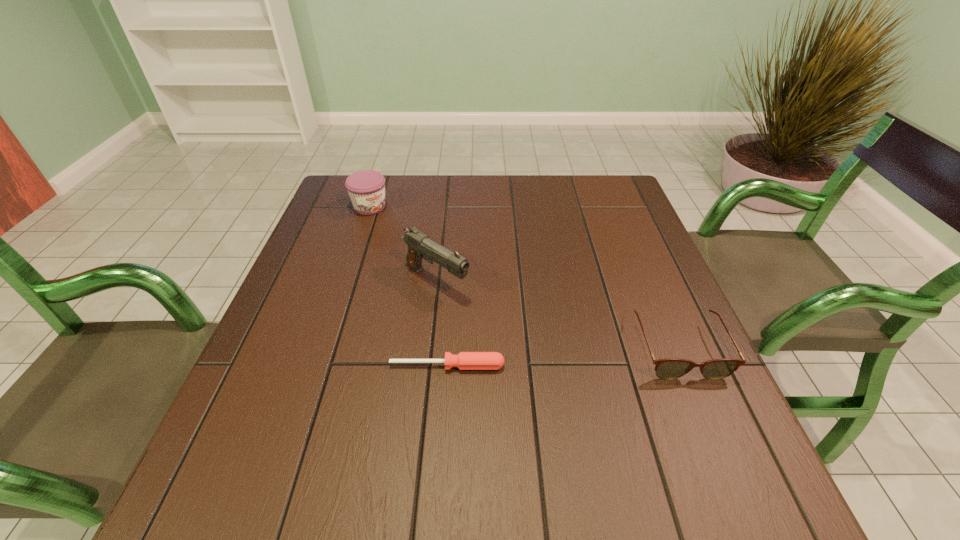
In the image, there is a desktop. Where is `free space at the left edge`? This screenshot has width=960, height=540. free space at the left edge is located at coordinates pos(263,392).

In the image, there is a desktop. What are the coordinates of `vacant space at the right edge` in the screenshot? It's located at (647, 256).

This screenshot has height=540, width=960. In order to click on vacant space at the far left corner of the desktop in this screenshot , I will do `click(341, 200)`.

In the image, there is a desktop. Identify the location of vacant space at the far right corner. The image size is (960, 540). 591,178.

This screenshot has width=960, height=540. Find the location of `free spot between the third shortest object and the shortest object`. free spot between the third shortest object and the shortest object is located at coordinates (409, 286).

What are the coordinates of `free space that is in between the rightmost object and the gun` in the screenshot? It's located at (558, 315).

This screenshot has width=960, height=540. I want to click on free spot between the jam and the tallest object, so click(x=403, y=244).

At what (x,y) coordinates should I click in order to perform the action: click on free spot between the shortest object and the third nearest object. Please return your answer as a coordinate pair (x, y). This screenshot has width=960, height=540. Looking at the image, I should click on (442, 323).

The image size is (960, 540). I want to click on vacant space in between the tallest object and the third shortest object, so 403,244.

Find the location of a particular element. The height and width of the screenshot is (540, 960). vacant point located between the second farthest object and the screwdriver is located at coordinates (442, 323).